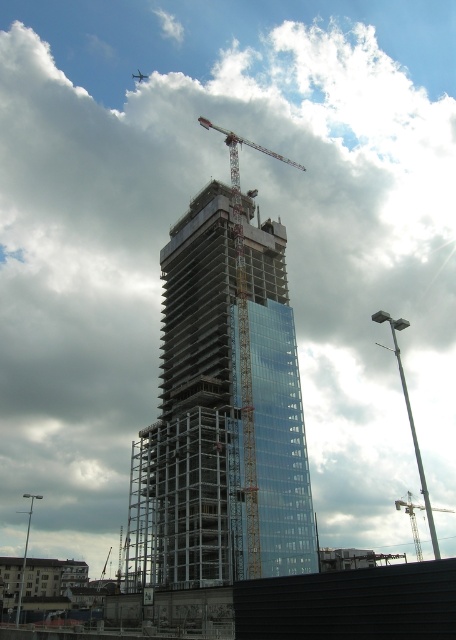
Is transparent glass tower at center closer to camera compared to metallic silver crane at center?

Yes, transparent glass tower at center is closer to the viewer.

Is transparent glass tower at center thinner than metallic silver crane at center?

Indeed, transparent glass tower at center has a lesser width compared to metallic silver crane at center.

Where is `transparent glass tower at center`? The height and width of the screenshot is (640, 456). transparent glass tower at center is located at coordinates tap(192, 417).

Locate an element on the screen. Image resolution: width=456 pixels, height=640 pixels. transparent glass tower at center is located at coordinates (192, 417).

Who is shorter, transparent glass tower at center or metallic construction crane at center?

transparent glass tower at center is shorter.

Between transparent glass tower at center and metallic construction crane at center, which one appears on the left side from the viewer's perspective?

From the viewer's perspective, transparent glass tower at center appears more on the left side.

Measure the distance between point (x=232, y=342) and camera.

Point (x=232, y=342) and camera are 73.75 meters apart.

Identify the location of transparent glass tower at center. This screenshot has width=456, height=640. (192, 417).

Is point (236, 202) closer to viewer compared to point (414, 538)?

Yes, it is.

Which is more to the left, metallic construction crane at center or metallic silver crane at center?

Positioned to the left is metallic construction crane at center.

Between point (253, 502) and point (400, 499), which one is positioned in front?

Point (253, 502) is more forward.

Where is `metallic construction crane at center`? Image resolution: width=456 pixels, height=640 pixels. metallic construction crane at center is located at coordinates (244, 348).